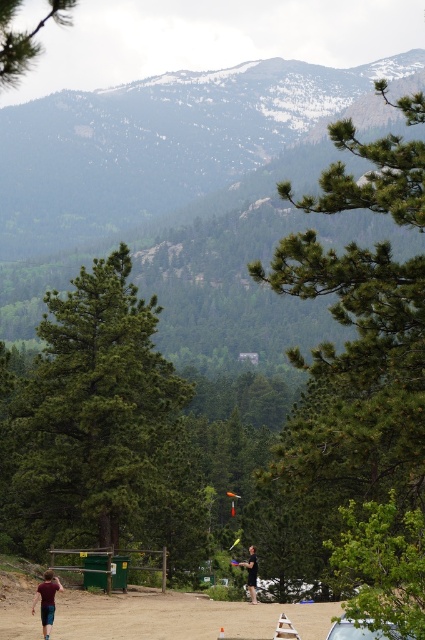
You are standing at the point marked by the coordinates (178,616) in the image. Based on the scene description, what material are you likely standing on?

The point at coordinates (178,616) corresponds to brown sandy dirt at lower center, so you are likely standing on brown sandy dirt.